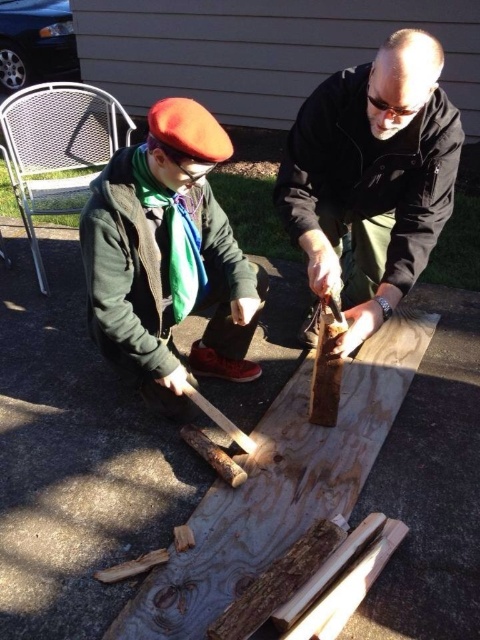
Based on the scene description, which object is bigger in size between the matte black shirt at center and the matte green jacket at center?

The matte black shirt at center is larger in size than the matte green jacket at center according to the description.

You are a delivery person who needs to place a package between the matte black shirt at center and the wooden plank at center. The package is 28 inches long. Can you fit it between them?

The matte black shirt at center and the wooden plank at center are 27.40 inches apart from each other. Since the package is 28 inches long, it cannot fit between them as the space is slightly smaller than the package.

Based on the photo, you are standing in front of the two people in the image. Which of the two points, point [295,145] or point [104,168], is closer to you?

Point [295,145] is closer to the viewer than point [104,168].